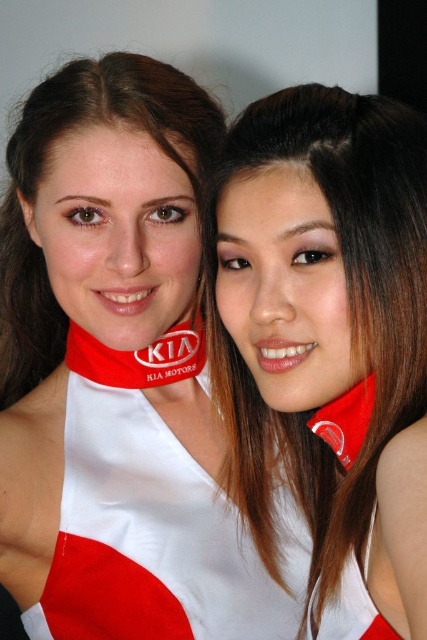
Consider the image. Between white matte necktie at center and red fabric at center, which one is positioned lower?

white matte necktie at center

Locate an element on the screen. This screenshot has width=427, height=640. white matte necktie at center is located at coordinates (328, 342).